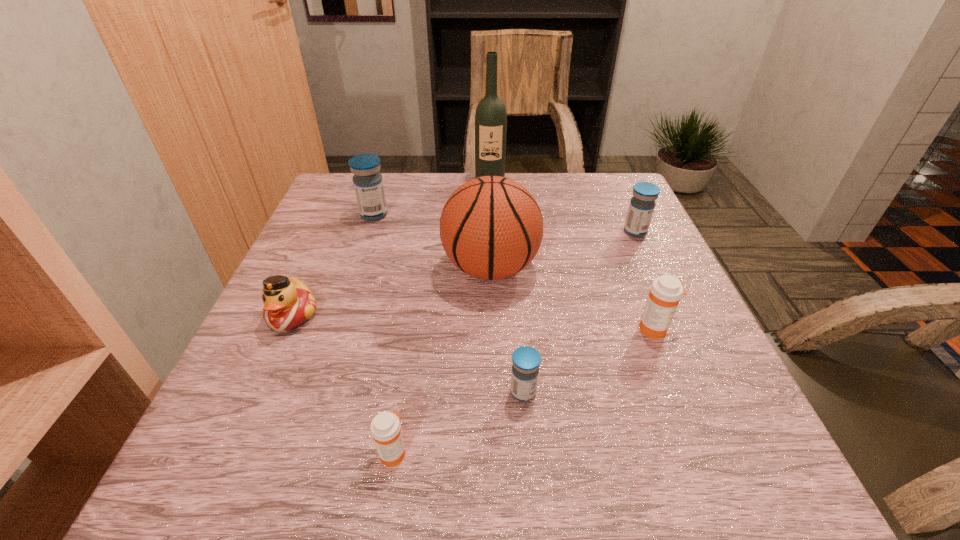
What are the coordinates of `vacant space that's between the leftmost object and the second blue medicine from left to right` in the screenshot? It's located at (408, 354).

I want to click on free spot between the second nearest object and the seventh nearest object, so click(x=448, y=303).

I want to click on unoccupied area between the nearest object and the third medicine from right to left, so click(458, 422).

What are the coordinates of `free space between the farther orange medicine and the second farthest blue medicine` in the screenshot? It's located at (645, 280).

You are a GUI agent. You are given a task and a screenshot of the screen. Output one action in this format:
    pyautogui.click(x=<x>, y=<y>)
    Task: Click on the empty space that is in between the tallest object and the red duck
    
    Given the screenshot: What is the action you would take?
    pyautogui.click(x=391, y=247)

Identify the location of free space between the sixth shortest object and the third medicine from left to right. (448, 303).

This screenshot has height=540, width=960. Find the location of `free space between the duck and the second blue medicine from right to left`. free space between the duck and the second blue medicine from right to left is located at coordinates (408, 354).

You are a GUI agent. You are given a task and a screenshot of the screen. Output one action in this format:
    pyautogui.click(x=<x>, y=<y>)
    Task: Click on the free space between the second farthest object and the second tallest object
    The width and height of the screenshot is (960, 540).
    Given the screenshot: What is the action you would take?
    pyautogui.click(x=432, y=241)

You are a GUI agent. You are given a task and a screenshot of the screen. Output one action in this format:
    pyautogui.click(x=<x>, y=<y>)
    Task: Click on the object identified as the seventh closest to the nearer orange medicine
    This screenshot has width=960, height=540.
    Given the screenshot: What is the action you would take?
    pyautogui.click(x=490, y=117)

Locate which object is the sixth closest to the duck. Please provide its 2D coordinates. Your answer should be formatted as a tuple, i.e. [(x, y)], where the tuple contains the x and y coordinates of a point satisfying the conditions above.

[(666, 291)]